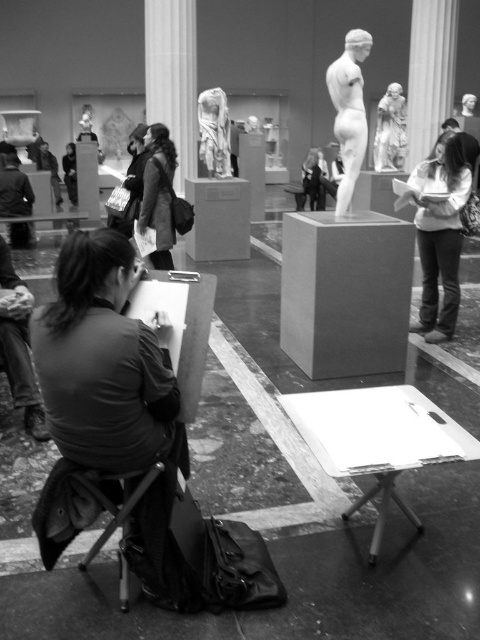
Does point (225, 124) come in front of point (71, 144)?

Yes, it is in front of point (71, 144).

Can you confirm if matte white statue at upper center is positioned above matte black jacket at center?

Incorrect, matte white statue at upper center is not positioned above matte black jacket at center.

Which is behind, point (200, 147) or point (68, 170)?

Positioned behind is point (68, 170).

I want to click on matte white statue at upper center, so click(x=214, y=132).

Which is in front, point (144, 193) or point (69, 168)?

Point (144, 193) is in front.

Is point (166, 156) closer to viewer compared to point (70, 180)?

Yes, point (166, 156) is in front of point (70, 180).

What do you see at coordinates (158, 195) in the screenshot? I see `dark brown leather jacket at upper center` at bounding box center [158, 195].

This screenshot has height=640, width=480. Find the location of `dark brown leather jacket at upper center`. dark brown leather jacket at upper center is located at coordinates (158, 195).

Is point (147, 182) positioned in front of point (384, 106)?

Yes, point (147, 182) is closer to viewer.

From the picture: Which of these two, dark brown leather jacket at upper center or smooth marble statue at upper right, stands shorter?

Standing shorter between the two is smooth marble statue at upper right.

Which is behind, point (145, 161) or point (385, 145)?

The point (385, 145) is more distant.

Where is `dark brown leather jacket at upper center`? The image size is (480, 640). dark brown leather jacket at upper center is located at coordinates (x=158, y=195).